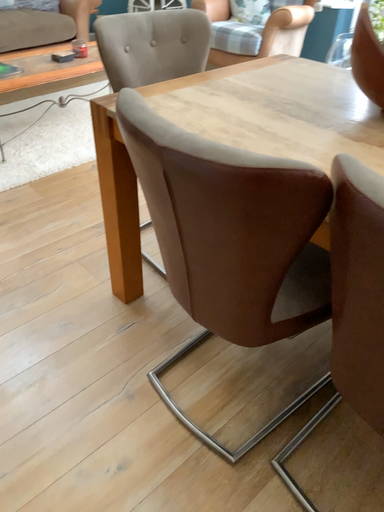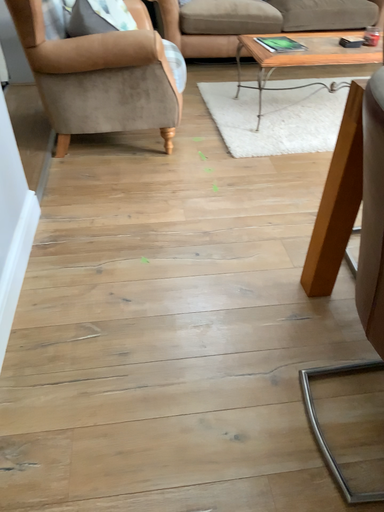
Question: Which way did the camera rotate in the video?

Choices:
 (A) rotated left
 (B) rotated right

Answer: (A)